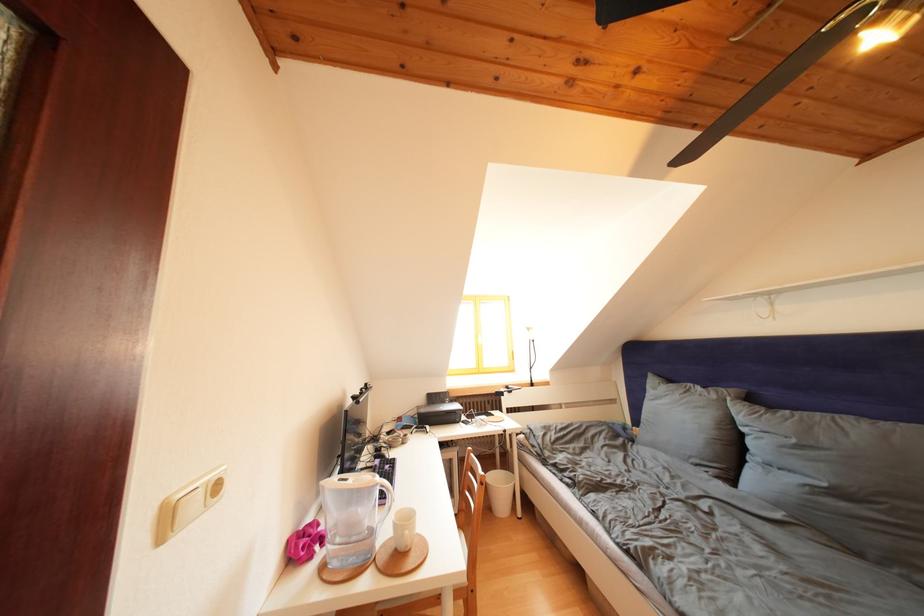
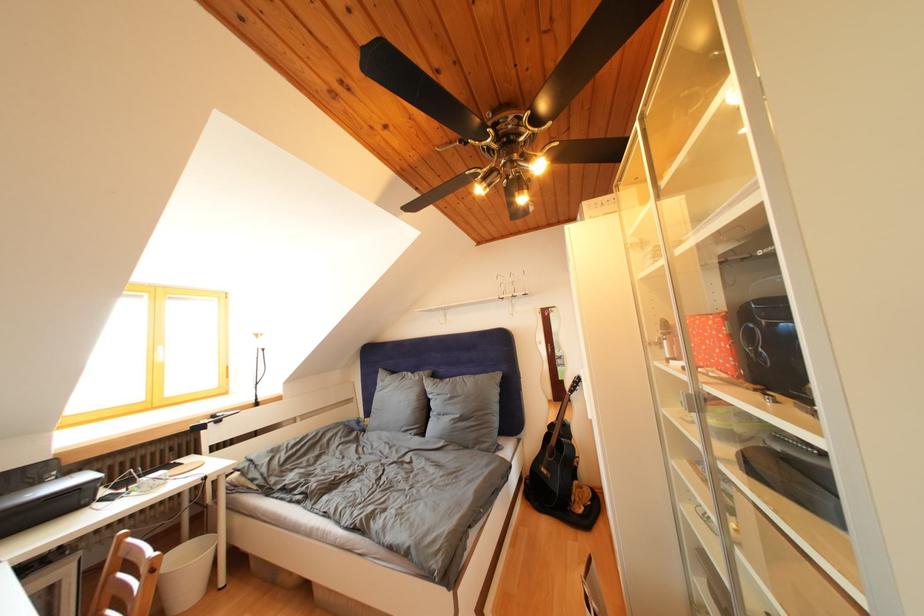
In the second image, find the point that corresponds to point 722,402 in the first image.

(426, 383)